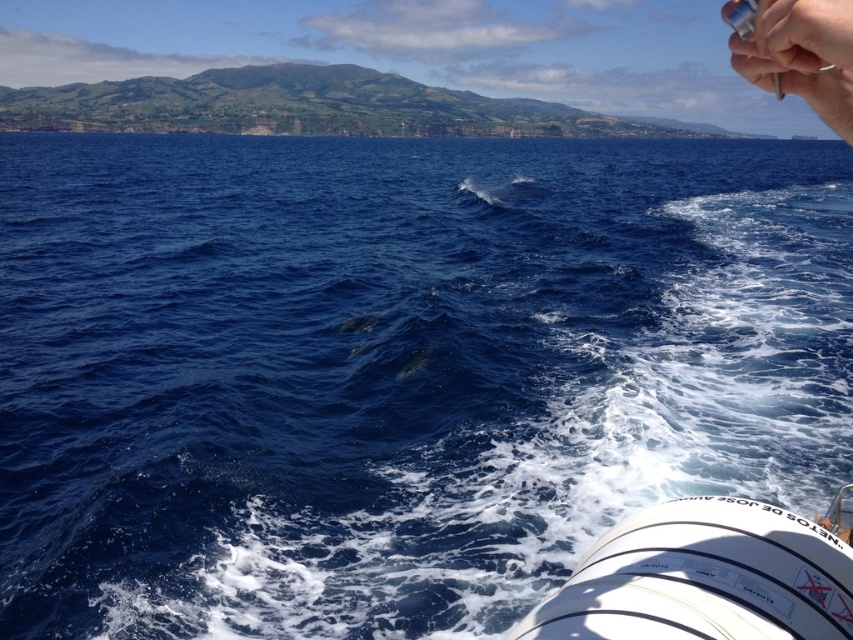
Question: Observing the image, what is the correct spatial positioning of white glossy boat at lower right in reference to metallic pen at upper right?

Choices:
 (A) right
 (B) left

Answer: (B)

Question: Which point is farther to the camera?

Choices:
 (A) (833, 113)
 (B) (682, 564)

Answer: (B)

Question: Does white glossy boat at lower right have a smaller size compared to metallic pen at upper right?

Choices:
 (A) no
 (B) yes

Answer: (B)

Question: Which point is farther from the camera taking this photo?

Choices:
 (A) (x=770, y=8)
 (B) (x=746, y=602)

Answer: (B)

Question: Can you confirm if white glossy boat at lower right is bigger than metallic pen at upper right?

Choices:
 (A) no
 (B) yes

Answer: (A)